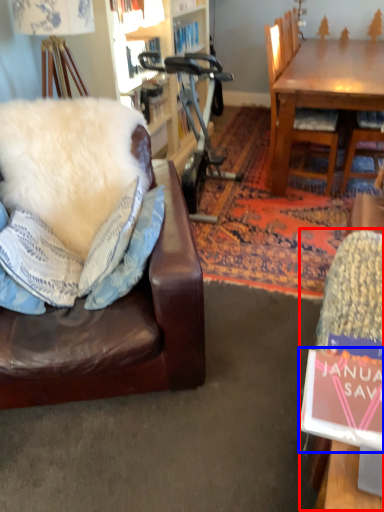
Question: Which of the following is the closest to the observer, swivel chair (highlighted by a red box) or book (highlighted by a blue box)?

Choices:
 (A) swivel chair
 (B) book

Answer: (B)